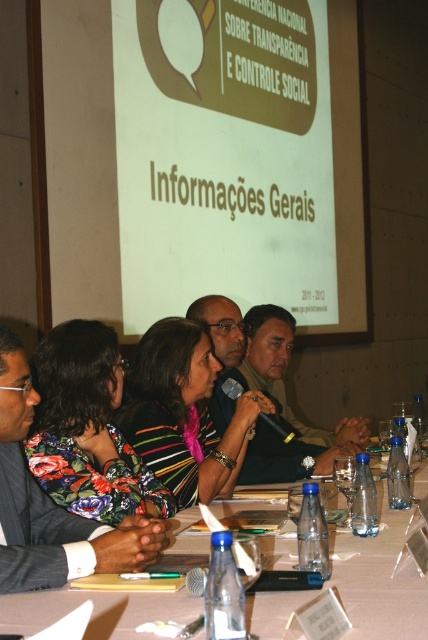
Question: Is the position of white plastic table at center more distant than that of matte black microphone at center?

Choices:
 (A) no
 (B) yes

Answer: (A)

Question: Among these objects, which one is farthest from the camera?

Choices:
 (A) matte black microphone at center
 (B) striped fabric at center
 (C) white plastic table at center

Answer: (A)

Question: Can you confirm if white plastic table at center is positioned above dark suit at center?

Choices:
 (A) yes
 (B) no

Answer: (B)

Question: Which point appears farthest from the camera in this image?

Choices:
 (A) 231,461
 (B) 291,444
 (C) 24,472

Answer: (B)

Question: Is white plastic table at center thinner than matte black microphone at center?

Choices:
 (A) yes
 (B) no

Answer: (B)

Question: Which object is farther from the camera taking this photo?

Choices:
 (A) striped fabric at center
 (B) matte black microphone at center
 (C) dark suit at center

Answer: (B)